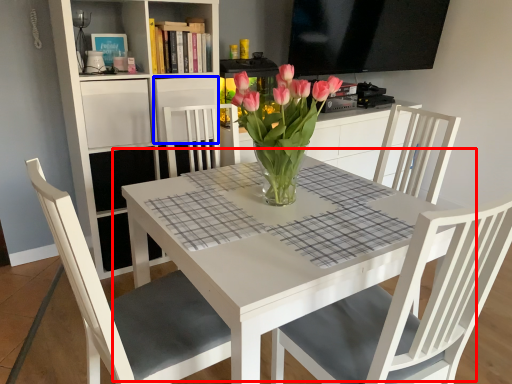
Question: Which of the following is the closest to the observer, table (highlighted by a red box) or shelf (highlighted by a blue box)?

Choices:
 (A) table
 (B) shelf

Answer: (A)